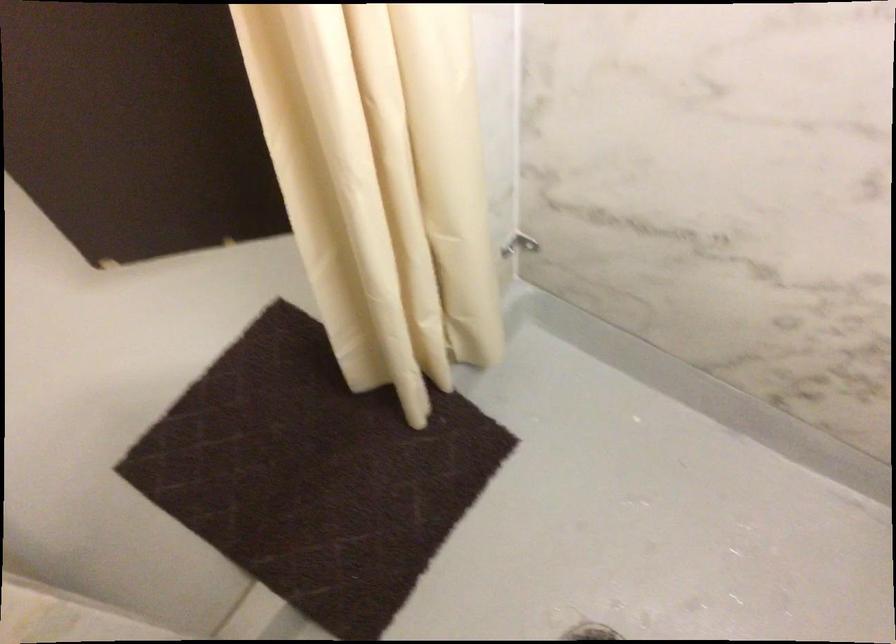
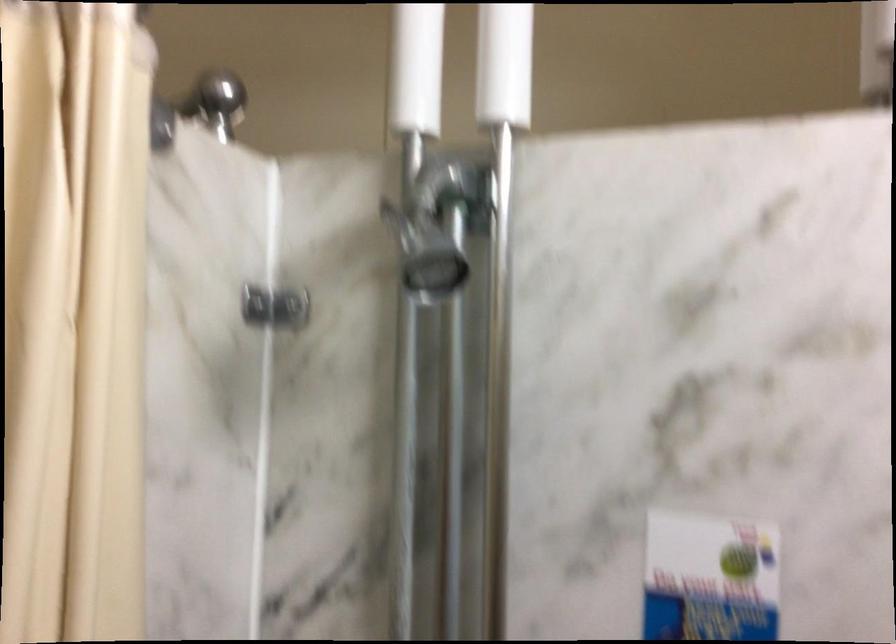
Question: The images are taken continuously from a first-person perspective. In which direction are you moving?

Choices:
 (A) Left
 (B) Right
 (C) Forward
 (D) Backward

Answer: (D)